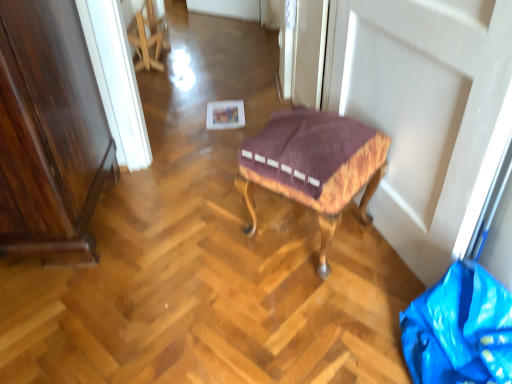
The width and height of the screenshot is (512, 384). Describe the element at coordinates (314, 166) in the screenshot. I see `velvet upholstered stool at center` at that location.

This screenshot has height=384, width=512. I want to click on velvet upholstered stool at center, so click(x=314, y=166).

The image size is (512, 384). What are the coordinates of `blue plastic bag at lower right` in the screenshot? It's located at (460, 329).

What do you see at coordinates (460, 329) in the screenshot? I see `blue plastic bag at lower right` at bounding box center [460, 329].

Image resolution: width=512 pixels, height=384 pixels. I want to click on velvet upholstered stool at center, so click(x=314, y=166).

Considering the positions of objects velvet upholstered stool at center and blue plastic bag at lower right in the image provided, who is more to the right, velvet upholstered stool at center or blue plastic bag at lower right?

blue plastic bag at lower right is more to the right.

Between velvet upholstered stool at center and blue plastic bag at lower right, which one is positioned behind?

velvet upholstered stool at center.

Is point (355, 162) closer or farther from the camera than point (500, 309)?

Point (355, 162).

From the image's perspective, is velvet upholstered stool at center over blue plastic bag at lower right?

Yes, from the image's perspective, velvet upholstered stool at center is over blue plastic bag at lower right.

From a real-world perspective, is velvet upholstered stool at center above or below blue plastic bag at lower right?

In terms of real-world spatial position, velvet upholstered stool at center is above blue plastic bag at lower right.

Is velvet upholstered stool at center thinner than blue plastic bag at lower right?

Yes.

Based on the photo, considering the relative sizes of velvet upholstered stool at center and blue plastic bag at lower right in the image provided, is velvet upholstered stool at center taller than blue plastic bag at lower right?

Correct, velvet upholstered stool at center is much taller as blue plastic bag at lower right.

Considering the relative sizes of velvet upholstered stool at center and blue plastic bag at lower right in the image provided, is velvet upholstered stool at center bigger than blue plastic bag at lower right?

Correct, velvet upholstered stool at center is larger in size than blue plastic bag at lower right.

Is blue plastic bag at lower right located within velvet upholstered stool at center?

No, blue plastic bag at lower right is located outside of velvet upholstered stool at center.

Is velvet upholstered stool at center next to blue plastic bag at lower right and touching it?

No, velvet upholstered stool at center is not beside blue plastic bag at lower right.

Is velvet upholstered stool at center turned away from blue plastic bag at lower right?

No, velvet upholstered stool at center is not facing away from blue plastic bag at lower right.

The height and width of the screenshot is (384, 512). Identify the location of stool above the blue plastic bag at lower right (from the image's perspective). (314, 166).

Can you confirm if blue plastic bag at lower right is positioned to the left of velvet upholstered stool at center?

Incorrect, blue plastic bag at lower right is not on the left side of velvet upholstered stool at center.

Does blue plastic bag at lower right come behind velvet upholstered stool at center?

That is False.

Which point is more distant from viewer, [460,307] or [315,164]?

The point [315,164] is more distant.

Consider the image. From the image's perspective, relative to velvet upholstered stool at center, is blue plastic bag at lower right above or below?

blue plastic bag at lower right is situated lower than velvet upholstered stool at center in the image.

In the scene shown: From a real-world perspective, is blue plastic bag at lower right above or below velvet upholstered stool at center?

blue plastic bag at lower right is below velvet upholstered stool at center.

Looking at their sizes, would you say blue plastic bag at lower right is wider or thinner than velvet upholstered stool at center?

Clearly, blue plastic bag at lower right has more width compared to velvet upholstered stool at center.

Considering the relative sizes of blue plastic bag at lower right and velvet upholstered stool at center in the image provided, is blue plastic bag at lower right taller than velvet upholstered stool at center?

Incorrect, the height of blue plastic bag at lower right is not larger of that of velvet upholstered stool at center.

Does blue plastic bag at lower right have a smaller size compared to velvet upholstered stool at center?

Yes.

Would you say blue plastic bag at lower right is inside or outside velvet upholstered stool at center?

blue plastic bag at lower right is spatially situated outside velvet upholstered stool at center.

Are blue plastic bag at lower right and velvet upholstered stool at center located far from each other?

No, blue plastic bag at lower right is not far away from velvet upholstered stool at center.

Could you tell me if blue plastic bag at lower right is turned towards velvet upholstered stool at center?

No, blue plastic bag at lower right is not turned towards velvet upholstered stool at center.

I want to click on material located below the velvet upholstered stool at center (from the image's perspective), so click(x=460, y=329).

Identify the location of stool behind the blue plastic bag at lower right. The height and width of the screenshot is (384, 512). (314, 166).

This screenshot has width=512, height=384. What are the coordinates of `stool to the left of blue plastic bag at lower right` in the screenshot? It's located at (314, 166).